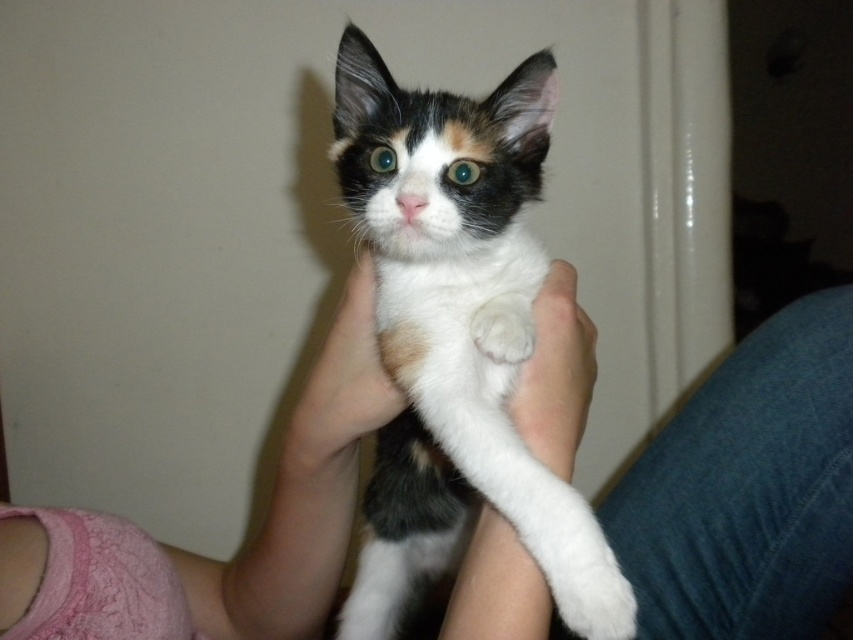
Question: Which point appears farthest from the camera in this image?

Choices:
 (A) (x=218, y=614)
 (B) (x=508, y=362)
 (C) (x=680, y=618)
 (D) (x=341, y=417)

Answer: (A)

Question: Does calico fur cat at center have a lesser width compared to white fluffy paw at center?

Choices:
 (A) yes
 (B) no

Answer: (B)

Question: Which of these objects is positioned closest to the calico fur cat at center?

Choices:
 (A) soft skin hand at center
 (B) white fluffy paw at center
 (C) pink fabric at upper left

Answer: (A)

Question: Is pink fabric at upper left above soft skin hand at center?

Choices:
 (A) no
 (B) yes

Answer: (A)

Question: Does white smooth skin at center have a greater width compared to soft skin hand at center?

Choices:
 (A) yes
 (B) no

Answer: (A)

Question: Which point is closer to the camera?

Choices:
 (A) [485, 332]
 (B) [741, 529]
 (C) [340, 141]
 (D) [360, 250]

Answer: (A)